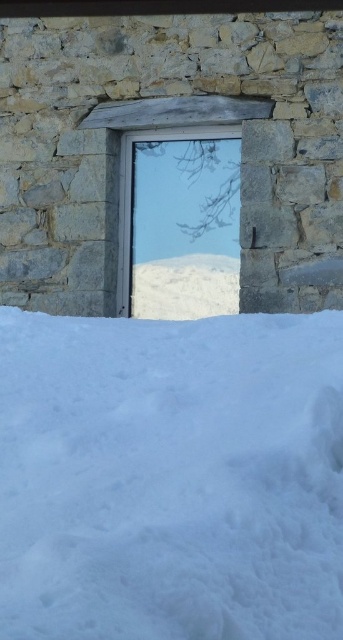
Can you confirm if white fluffy snow at lower center is positioned to the left of transparent glass window at center?

Indeed, white fluffy snow at lower center is positioned on the left side of transparent glass window at center.

Is white fluffy snow at lower center positioned in front of transparent glass window at center?

Yes, white fluffy snow at lower center is closer to the viewer.

What do you see at coordinates (171, 477) in the screenshot? I see `white fluffy snow at lower center` at bounding box center [171, 477].

Image resolution: width=343 pixels, height=640 pixels. What are the coordinates of `white fluffy snow at lower center` in the screenshot? It's located at (171, 477).